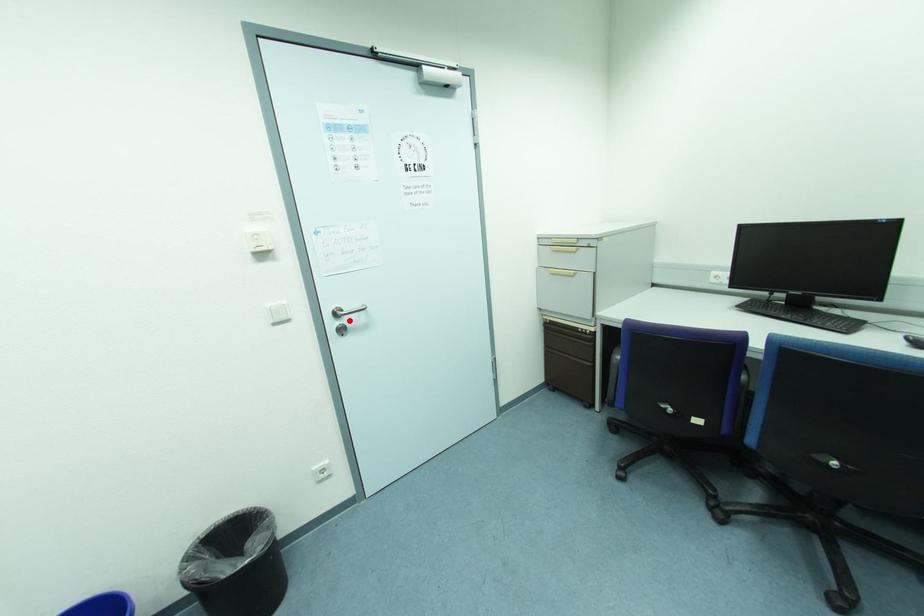
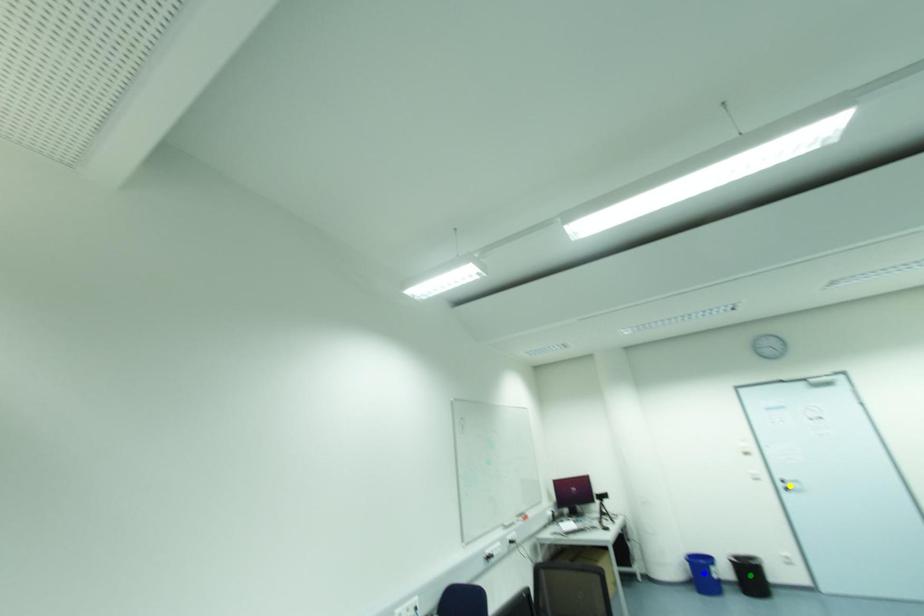
Question: I am providing you with two images of the same scene from different viewpoints. A red point is marked on the first image. You are given multiple points on the second image. Which spot in image 2 lines up with the point in image 1?

Choices:
 (A) green point
 (B) blue point
 (C) yellow point

Answer: (C)